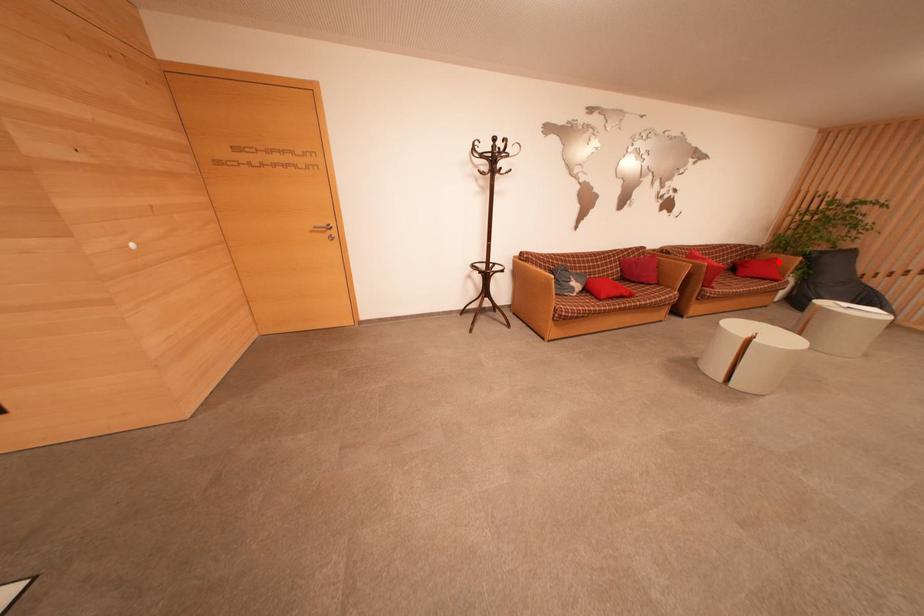
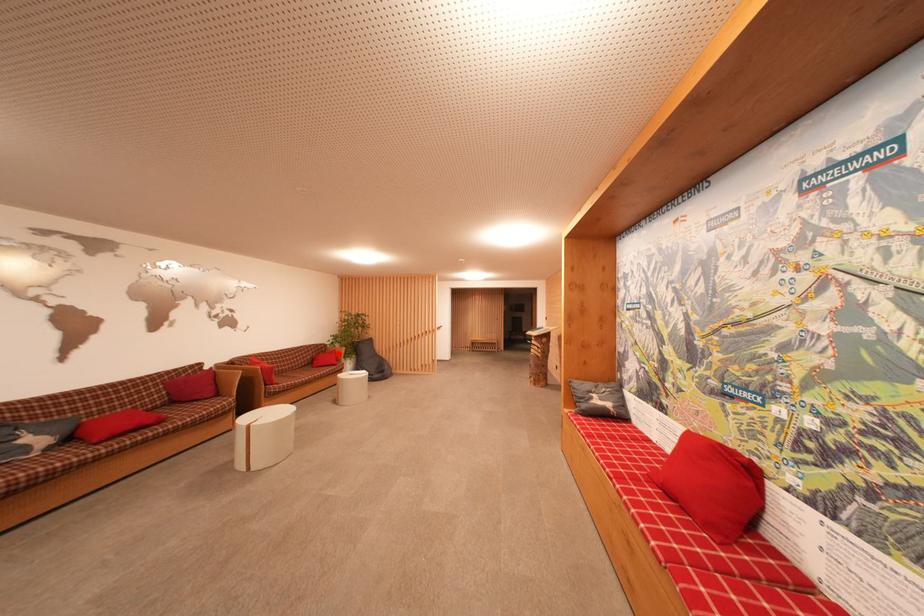
I am providing you with two images of the same scene from different viewpoints. A red point is marked on the first image and another point is marked on the second image. Is the red point in image1 aligned with the point shown in image2?

Yes